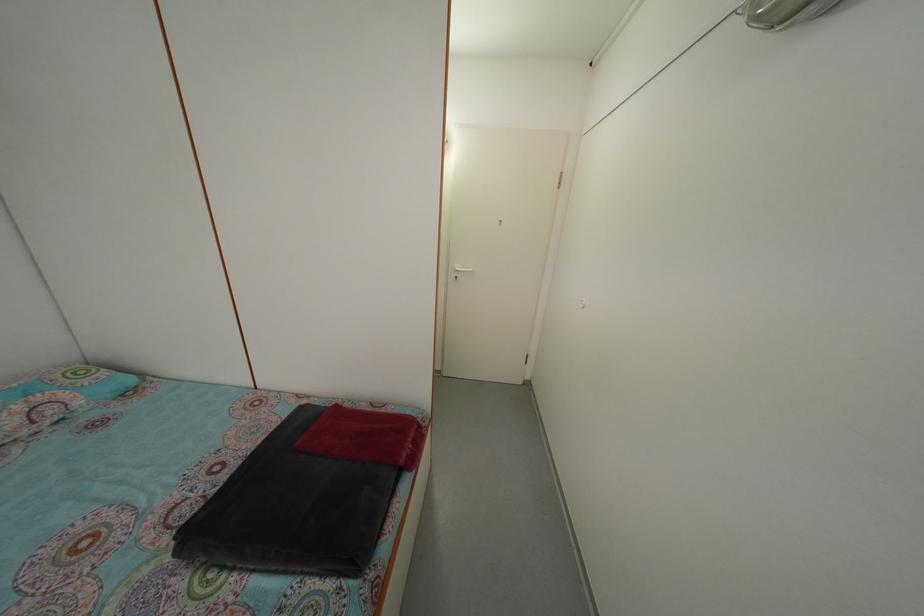
What do you see at coordinates (459, 270) in the screenshot? The height and width of the screenshot is (616, 924). I see `the white door handle` at bounding box center [459, 270].